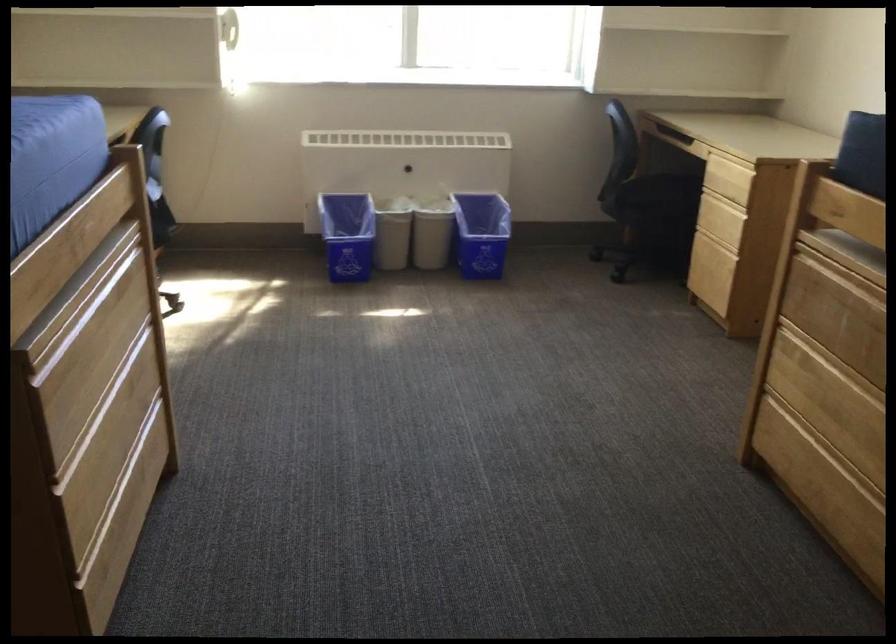
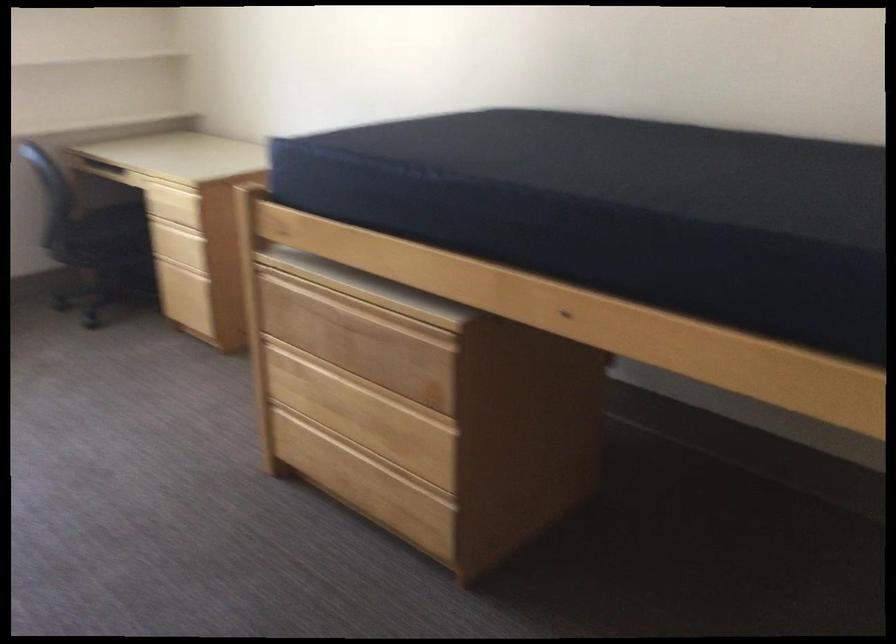
Question: How did the camera likely rotate?

Choices:
 (A) Left
 (B) Right
 (C) Up
 (D) Down

Answer: (B)